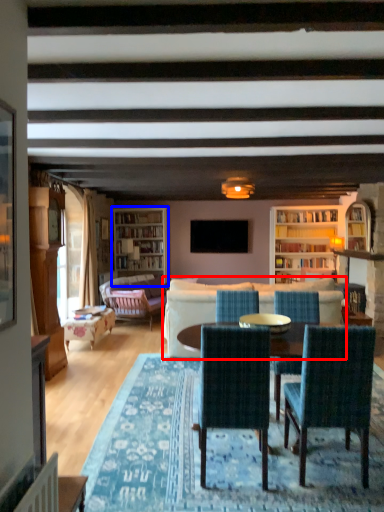
Question: Among these objects, which one is nearest to the camera, studio couch (highlighted by a red box) or bookcase (highlighted by a blue box)?

Choices:
 (A) studio couch
 (B) bookcase

Answer: (A)